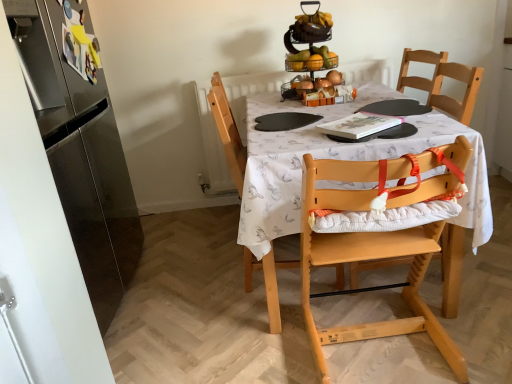
You are a GUI agent. You are given a task and a screenshot of the screen. Output one action in this format:
    pyautogui.click(x=<x>, y=<y>)
    Task: Click on the free space underneath light wood highchair at center, the first chair in the front-to-back sequence (from a real-world perspective)
    
    Given the screenshot: What is the action you would take?
    pyautogui.click(x=386, y=359)